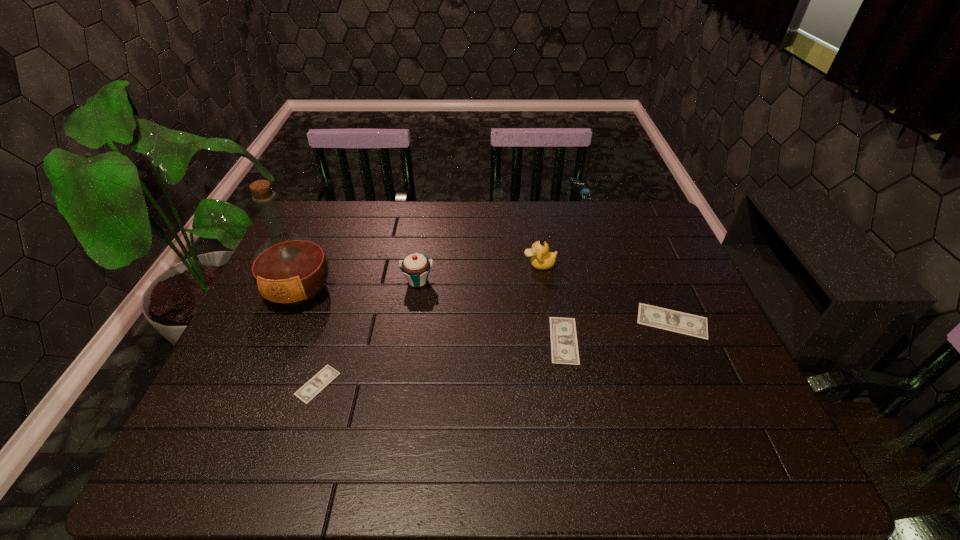
Find the location of a particular element. This screenshot has width=960, height=540. free location located 0.110m on the front of the rightmost object is located at coordinates (696, 377).

Image resolution: width=960 pixels, height=540 pixels. I want to click on free spot located on the front label of the tallest object, so click(x=282, y=330).

You are a GUI agent. You are given a task and a screenshot of the screen. Output one action in this format:
    pyautogui.click(x=<x>, y=<y>)
    Task: Click on the vacant space located 0.300m on the face of the duckling
    This screenshot has width=960, height=540.
    Given the screenshot: What is the action you would take?
    pyautogui.click(x=424, y=265)

This screenshot has width=960, height=540. I want to click on free space located on the face of the duckling, so click(468, 265).

At what (x,y) coordinates should I click in order to perform the action: click on free space located 0.140m on the face of the duckling. Please return your answer as a coordinate pair (x, y). The height and width of the screenshot is (540, 960). Looking at the image, I should click on (477, 265).

You are a GUI agent. You are given a task and a screenshot of the screen. Output one action in this format:
    pyautogui.click(x=<x>, y=<y>)
    Task: Click on the vacant position located 0.150m on the right of the cupcake
    
    Given the screenshot: What is the action you would take?
    (486, 281)

At what (x,y) coordinates should I click in order to perform the action: click on object that is at the near edge. Please return your answer as a coordinate pair (x, y). The width and height of the screenshot is (960, 540). Looking at the image, I should click on (307, 392).

You are a GUI agent. You are given a task and a screenshot of the screen. Output one action in this format:
    pyautogui.click(x=<x>, y=<y>)
    Task: Click on the object positioned at the left edge
    This screenshot has width=960, height=540.
    Given the screenshot: What is the action you would take?
    pyautogui.click(x=289, y=269)

Find the location of `object at the right edge`. object at the right edge is located at coordinates (683, 323).

I want to click on free space at the far edge of the desktop, so click(615, 231).